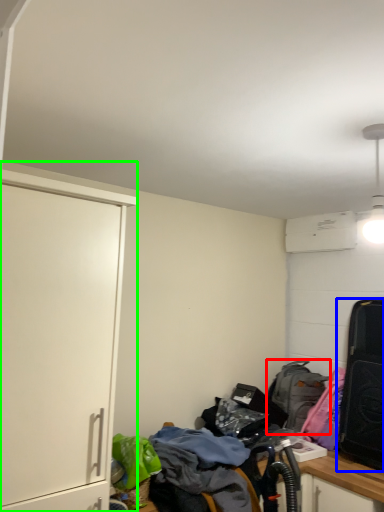
Question: Which is farther away from backpack (highlighted by a red box)? luggage and bags (highlighted by a blue box) or cabinetry (highlighted by a green box)?

Choices:
 (A) luggage and bags
 (B) cabinetry

Answer: (B)